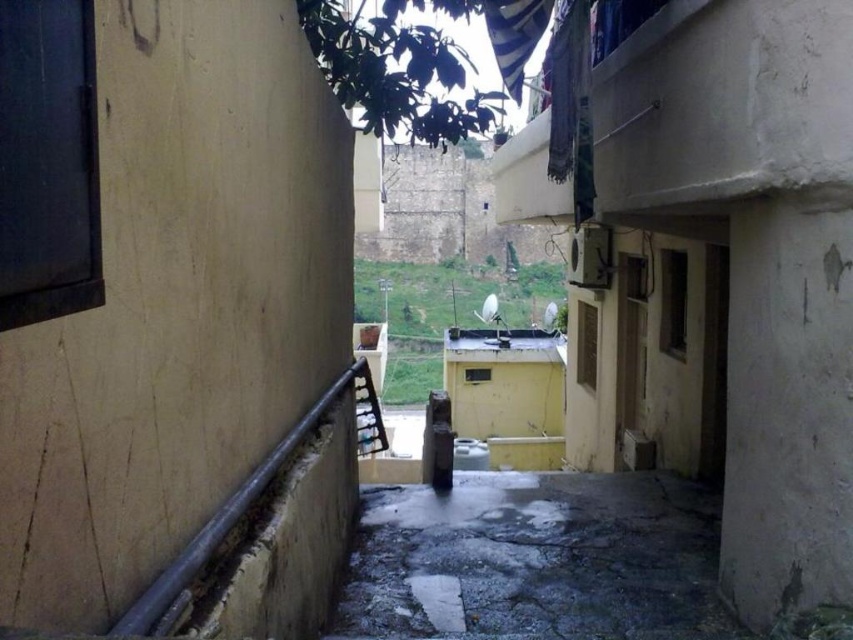
Question: Which point appears closest to the camera in this image?

Choices:
 (A) (265, 467)
 (B) (364, 394)

Answer: (A)

Question: Does rusty metal rail at left appear on the right side of wooden at center?

Choices:
 (A) no
 (B) yes

Answer: (A)

Question: Which point is closer to the camera?

Choices:
 (A) (186, 547)
 (B) (374, 432)

Answer: (A)

Question: Which point appears farthest from the camera in this image?

Choices:
 (A) (364, 403)
 (B) (260, 468)

Answer: (A)

Question: Is rusty metal rail at left below wooden at center?

Choices:
 (A) yes
 (B) no

Answer: (B)

Question: Does rusty metal rail at left appear on the right side of wooden at center?

Choices:
 (A) no
 (B) yes

Answer: (A)